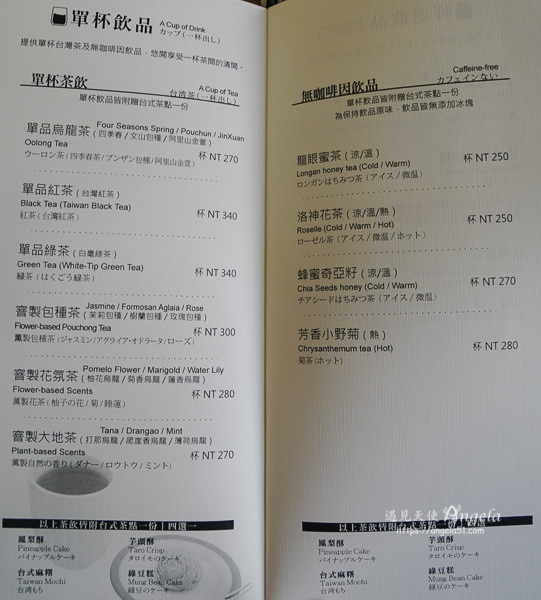
Image resolution: width=541 pixels, height=600 pixels. Find the location of `bar`. bar is located at coordinates (442, 517).